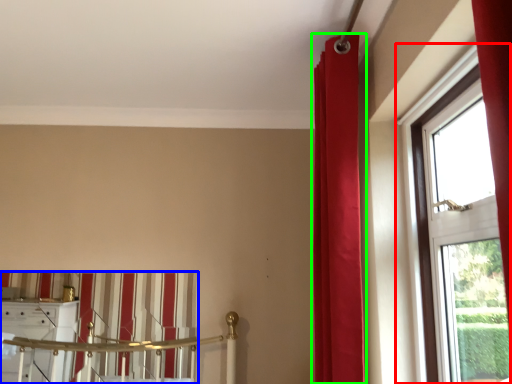
Question: Considering the real-world distances, which object is farthest from window (highlighted by a red box)? curtain (highlighted by a blue box) or curtain (highlighted by a green box)?

Choices:
 (A) curtain
 (B) curtain

Answer: (A)